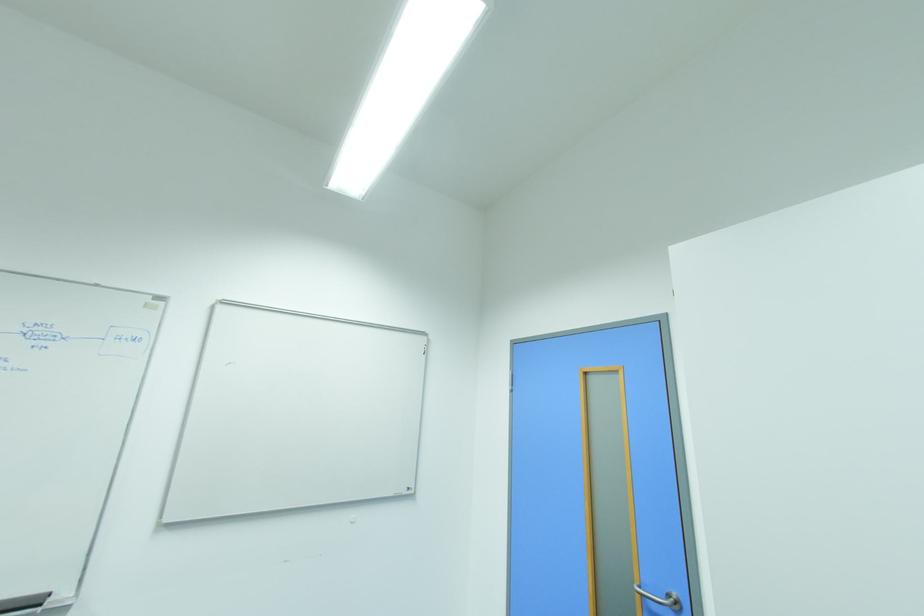
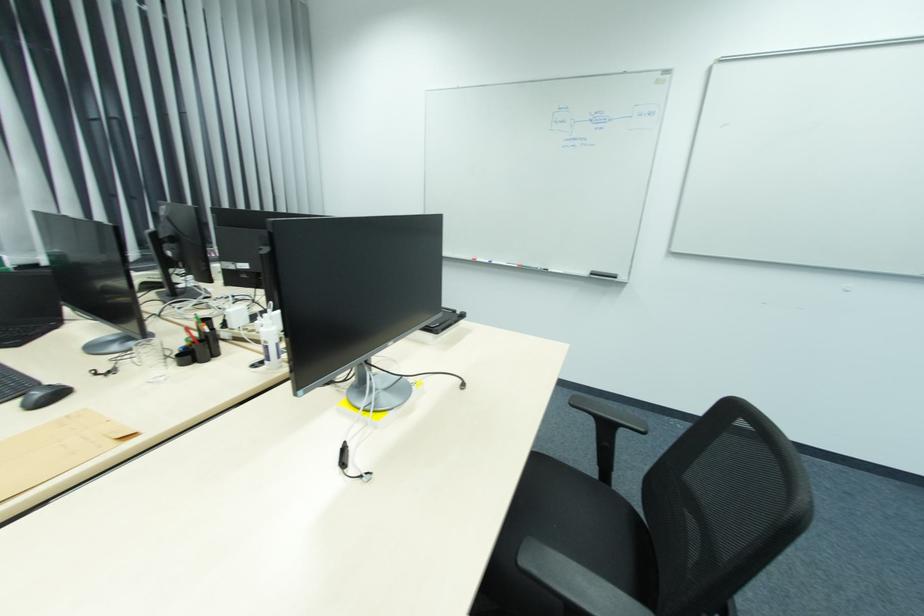
The images are taken continuously from a first-person perspective. In which direction is your viewpoint rotating?

The rotation direction of the camera is left-down.